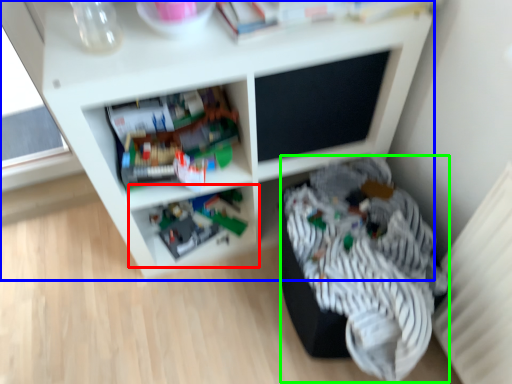
Question: Which object is the farthest from shelf (highlighted by a red box)? Choose among these: shelf (highlighted by a blue box) or clothing (highlighted by a green box).

Choices:
 (A) shelf
 (B) clothing

Answer: (B)